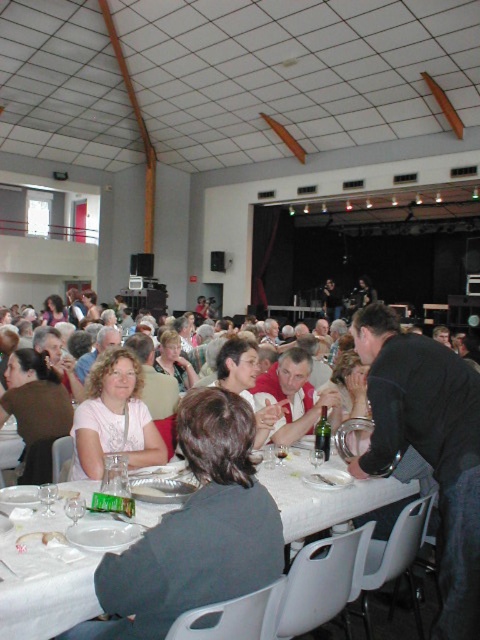
Where is the white plastic table at lower center located in the image?

The white plastic table at lower center is located at point (324, 497).

You are organizing a photo shoot in the hall and need to position two models wearing the white fabric shirt at center and the matte pink shirt at center. Since space is limited, you want to know which shirt requires more space between the models. Which model should be placed farther apart?

The white fabric shirt at center requires more space between the models because its width is larger than the matte pink shirt at center.